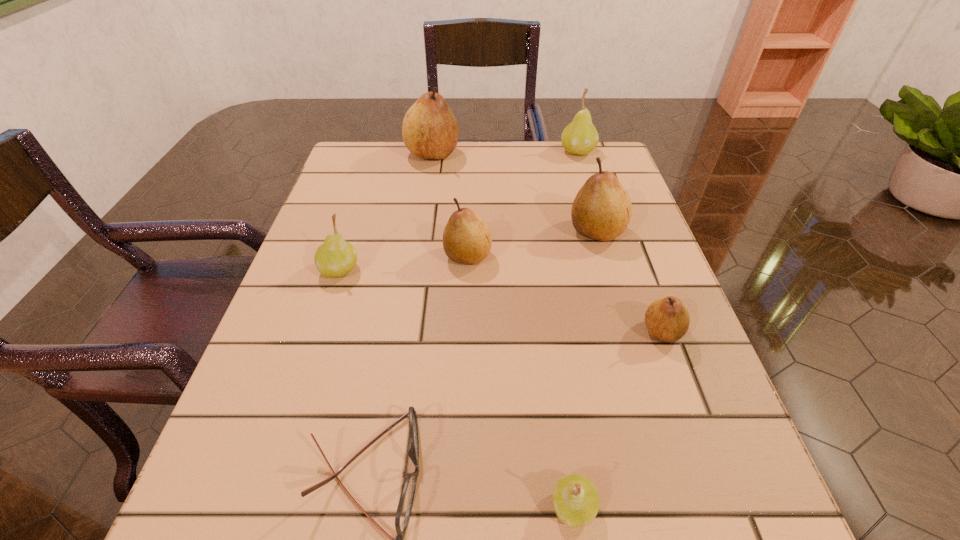
You are a GUI agent. You are given a task and a screenshot of the screen. Output one action in this format:
    pyautogui.click(x=<x>, y=<y>)
    Task: Click on the nearest green pear
    Image resolution: width=960 pixels, height=540 pixels.
    Given the screenshot: What is the action you would take?
    pyautogui.click(x=575, y=498)

Locate an element on the screen. The height and width of the screenshot is (540, 960). the fourth pear from left to right is located at coordinates (575, 498).

Find the location of a particular element. The image size is (960, 540). vacant space located 0.310m on the right of the biggest brown pear is located at coordinates (573, 154).

At what (x,y) coordinates should I click in order to perform the action: click on vacant space situated on the front of the farthest green pear. Please return your answer as a coordinate pair (x, y). Looking at the image, I should click on (606, 244).

Locate an element on the screen. free spot located on the left of the third smallest brown pear is located at coordinates (423, 231).

Locate an element on the screen. This screenshot has width=960, height=540. vacant space situated on the back of the leftmost pear is located at coordinates (362, 200).

Identify the location of vacant region located 0.280m on the right of the third biggest brown pear. This screenshot has height=540, width=960. (627, 256).

Locate an element on the screen. vacant space located on the back of the third nearest object is located at coordinates (639, 269).

Where is `blank area located on the right of the fifth object from left to right`? This screenshot has width=960, height=540. blank area located on the right of the fifth object from left to right is located at coordinates (641, 507).

Where is `object that is at the near edge`? This screenshot has width=960, height=540. object that is at the near edge is located at coordinates (575, 498).